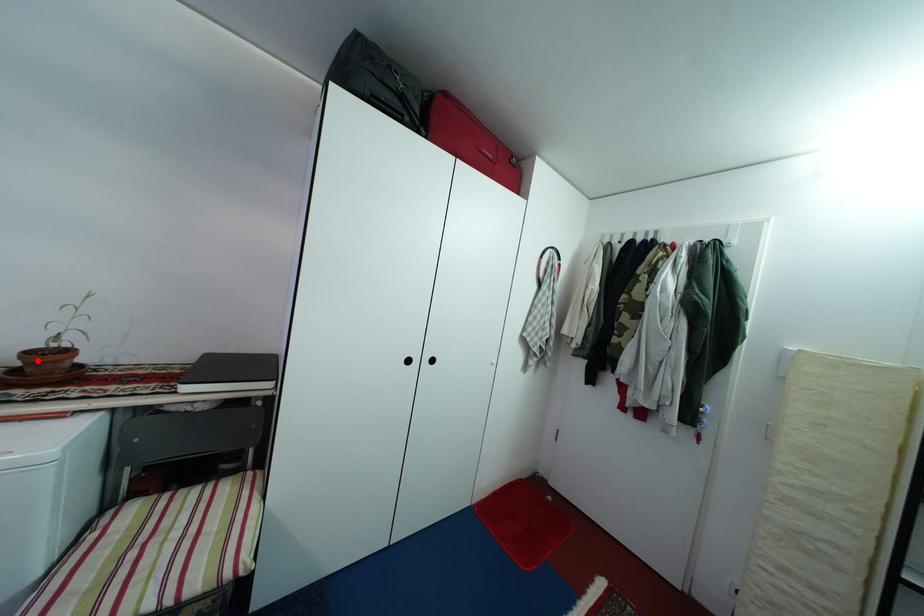
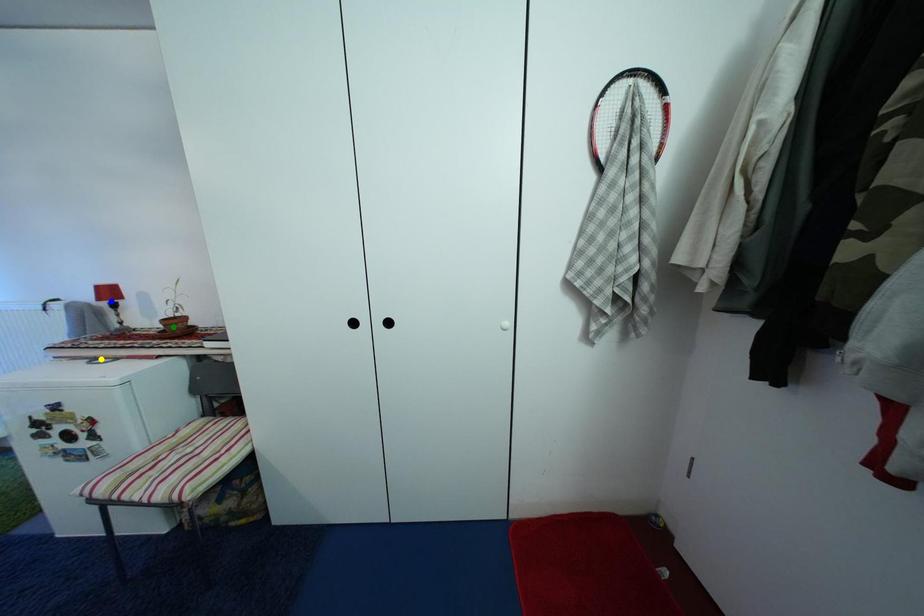
Question: I am providing you with two images of the same scene from different viewpoints. A red point is marked on the first image. You are given multiple points on the second image. Which point in image 2 is actually the same real-world point as the red point in image 1?

Choices:
 (A) yellow point
 (B) green point
 (C) blue point

Answer: (B)